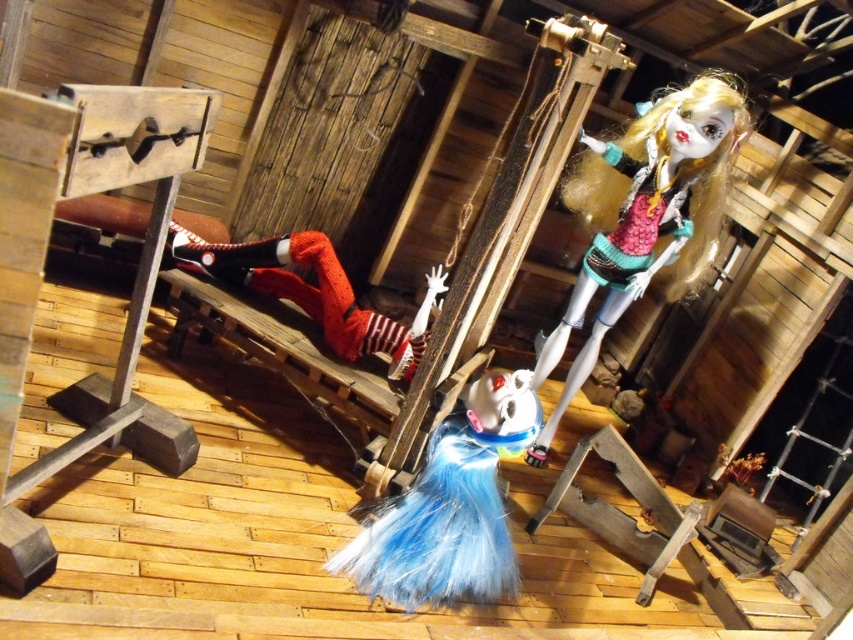
Is point (442, 436) farther from viewer compared to point (357, 310)?

No, (442, 436) is closer to viewer.

Between point (418, 560) and point (245, 282), which one is positioned behind?

The point (245, 282) is more distant.

Measure the distance between point (x=503, y=560) and camera.

Point (x=503, y=560) is 3.27 meters from camera.

Locate an element on the screen. This screenshot has height=640, width=853. blue fuzzy doll at center is located at coordinates (450, 506).

Is point (616, 250) less distant than point (413, 356)?

No.

This screenshot has height=640, width=853. I want to click on shiny teal fabric doll at upper right, so click(x=643, y=216).

From the picture: Between shiny teal fabric doll at upper right and blue fuzzy doll at center, which one appears on the left side from the viewer's perspective?

blue fuzzy doll at center

Does shiny teal fabric doll at upper right have a smaller size compared to blue fuzzy doll at center?

Incorrect, shiny teal fabric doll at upper right is not smaller in size than blue fuzzy doll at center.

Describe the element at coordinates (643, 216) in the screenshot. I see `shiny teal fabric doll at upper right` at that location.

Image resolution: width=853 pixels, height=640 pixels. I want to click on shiny teal fabric doll at upper right, so click(x=643, y=216).